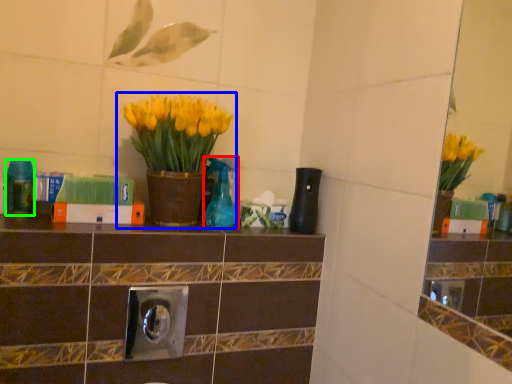
Question: Which object is positioned closest to bottle (highlighted by a red box)? Select from houseplant (highlighted by a blue box) and bottle (highlighted by a green box).

Choices:
 (A) houseplant
 (B) bottle

Answer: (A)